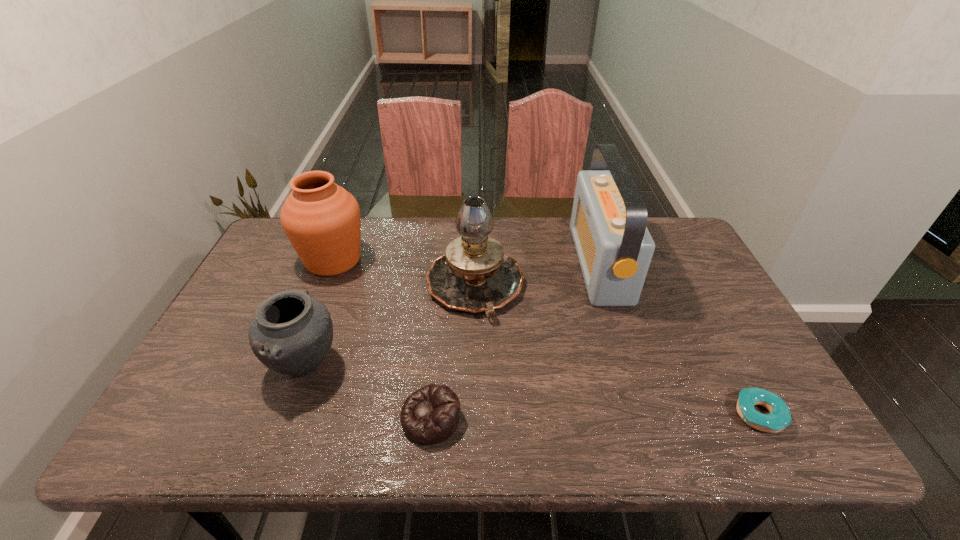
Where is `object that stands as the fourth closest to the beanbag`? object that stands as the fourth closest to the beanbag is located at coordinates (608, 223).

Find the location of a particular element. object that is the third nearest to the fifth tallest object is located at coordinates (322, 221).

Where is `vacant space that satisfies the following two spatial constraints: 1. on the front-facing side of the fifth object from left to right; 2. on the back side of the rightmost object`? vacant space that satisfies the following two spatial constraints: 1. on the front-facing side of the fifth object from left to right; 2. on the back side of the rightmost object is located at coordinates (648, 415).